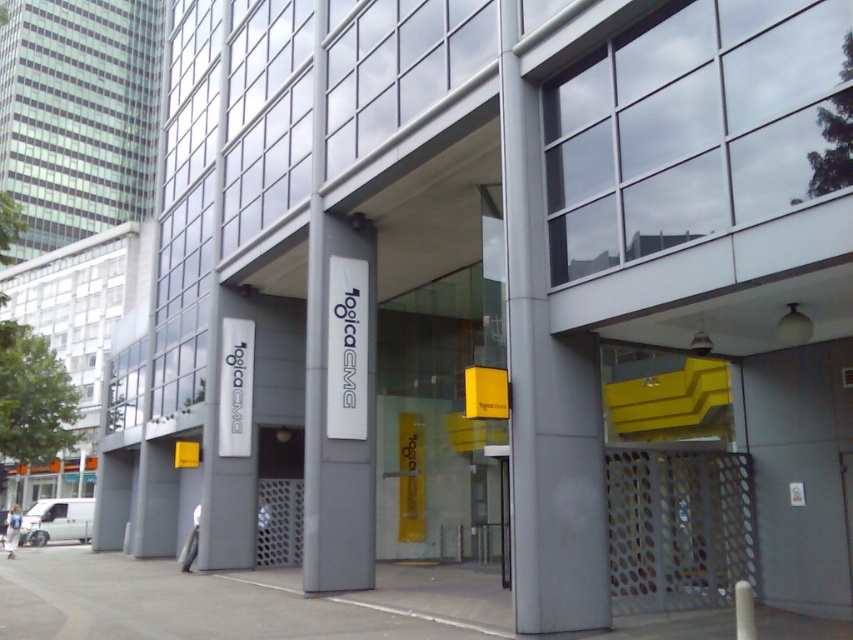
Question: Is gray metallic sign at center wider than white matte van at lower left?

Choices:
 (A) yes
 (B) no

Answer: (B)

Question: Can you confirm if gray metallic sign at center is wider than white matte van at lower left?

Choices:
 (A) no
 (B) yes

Answer: (A)

Question: Is gray metallic sign at center bigger than white matte van at lower left?

Choices:
 (A) yes
 (B) no

Answer: (B)